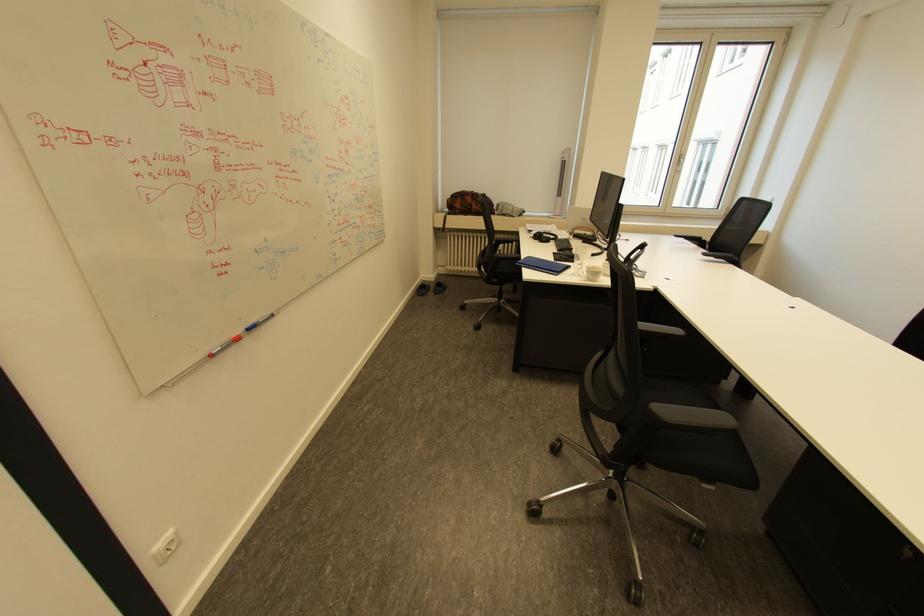
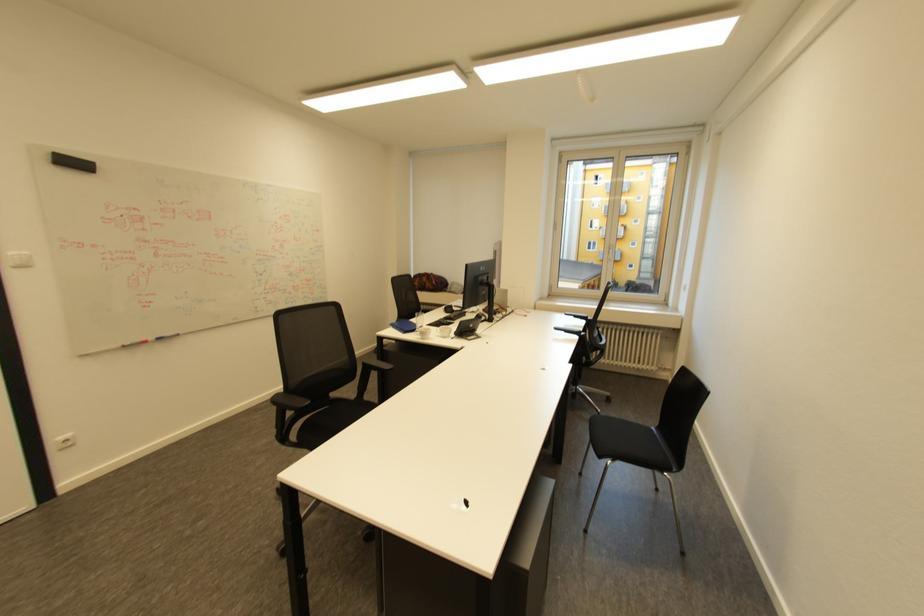
The point at [257,329] is marked in the first image. Where is the corresponding point in the second image?

(164, 339)